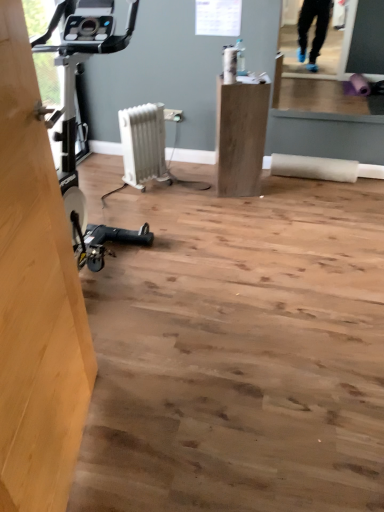
Identify the location of matte wood cabinet at center. The image size is (384, 512). (240, 136).

The width and height of the screenshot is (384, 512). What do you see at coordinates (36, 298) in the screenshot? I see `light brown wood at left` at bounding box center [36, 298].

Where is `matte wood cabinet at center`? matte wood cabinet at center is located at coordinates (240, 136).

Who is smaller, white plastic radiator at center or light brown wood at left?

white plastic radiator at center.

Which of these two, white plastic radiator at center or light brown wood at left, is wider?

white plastic radiator at center is wider.

Is white plastic radiator at center in front of light brown wood at left?

No, it is not.

Is white plastic radiator at center completely or partially outside of light brown wood at left?

That's correct, white plastic radiator at center is outside of light brown wood at left.

Is white plastic radiator at center far from matte wood cabinet at center?

They are positioned close to each other.

Based on the photo, can we say white plastic radiator at center lies outside matte wood cabinet at center?

white plastic radiator at center lies outside matte wood cabinet at center's area.

At what (x,y) coordinates should I click in order to perform the action: click on radiator below the matte wood cabinet at center (from the image's perspective). Please return your answer as a coordinate pair (x, y). Looking at the image, I should click on (143, 144).

Based on the photo, from a real-world perspective, is matte wood cabinet at center positioned above or below white plastic radiator at center?

From a real-world perspective, matte wood cabinet at center is physically above white plastic radiator at center.

What's the angular difference between matte wood cabinet at center and white plastic radiator at center's facing directions?

The angle between the facing direction of matte wood cabinet at center and the facing direction of white plastic radiator at center is 41.5 degrees.

Is matte wood cabinet at center in front of or behind white plastic radiator at center in the image?

matte wood cabinet at center is positioned closer to the viewer than white plastic radiator at center.

From the image's perspective, which is below, matte wood cabinet at center or white plastic radiator at center?

white plastic radiator at center.

Looking at their sizes, would you say matte wood cabinet at center is wider or thinner than light brown wood at left?

In the image, matte wood cabinet at center appears to be wider than light brown wood at left.

Which is in front, matte wood cabinet at center or light brown wood at left?

light brown wood at left is more forward.

Which of these two, matte wood cabinet at center or light brown wood at left, stands taller?

light brown wood at left.

Relative to white plastic radiator at center, is light brown wood at left in front or behind?

light brown wood at left is in front of white plastic radiator at center.

Is light brown wood at left turned away from white plastic radiator at center?

No.

Which is less distant, (17, 174) or (161, 158)?

Clearly, point (17, 174) is closer to the camera than point (161, 158).

Between light brown wood at left and white plastic radiator at center, which one appears on the right side from the viewer's perspective?

Positioned to the right is white plastic radiator at center.

From a real-world perspective, which object rests below the other?

matte wood cabinet at center is physically lower.

Is light brown wood at left next to matte wood cabinet at center and touching it?

light brown wood at left and matte wood cabinet at center are not in contact.

There is a matte wood cabinet at center. At what (x,y) coordinates should I click in order to perform the action: click on plywood above it (from a real-world perspective). Please return your answer as a coordinate pair (x, y). Looking at the image, I should click on (36, 298).

Does light brown wood at left turn towards matte wood cabinet at center?

No, light brown wood at left is not turned towards matte wood cabinet at center.

You are a GUI agent. You are given a task and a screenshot of the screen. Output one action in this format:
    pyautogui.click(x=<x>, y=<y>)
    Task: Click on the plywood on the left of white plastic radiator at center
    The image size is (384, 512).
    Given the screenshot: What is the action you would take?
    pyautogui.click(x=36, y=298)

The image size is (384, 512). I want to click on radiator below the matte wood cabinet at center (from the image's perspective), so click(x=143, y=144).

When comparing their distances from matte wood cabinet at center, does light brown wood at left or white plastic radiator at center seem further?

light brown wood at left is further to matte wood cabinet at center.

Based on their spatial positions, is white plastic radiator at center or light brown wood at left further from matte wood cabinet at center?

The object further to matte wood cabinet at center is light brown wood at left.

Estimate the real-world distances between objects in this image. Which object is closer to white plastic radiator at center, matte wood cabinet at center or light brown wood at left?

Among the two, matte wood cabinet at center is located nearer to white plastic radiator at center.

Which object lies further to the anchor point white plastic radiator at center, light brown wood at left or matte wood cabinet at center?

light brown wood at left is further to white plastic radiator at center.

Based on their spatial positions, is white plastic radiator at center or matte wood cabinet at center further from light brown wood at left?

The object further to light brown wood at left is white plastic radiator at center.

Looking at the image, which one is located further to light brown wood at left, matte wood cabinet at center or white plastic radiator at center?

white plastic radiator at center.

Locate an element on the screen. This screenshot has height=512, width=384. furniture located between light brown wood at left and white plastic radiator at center in the depth direction is located at coordinates (240, 136).